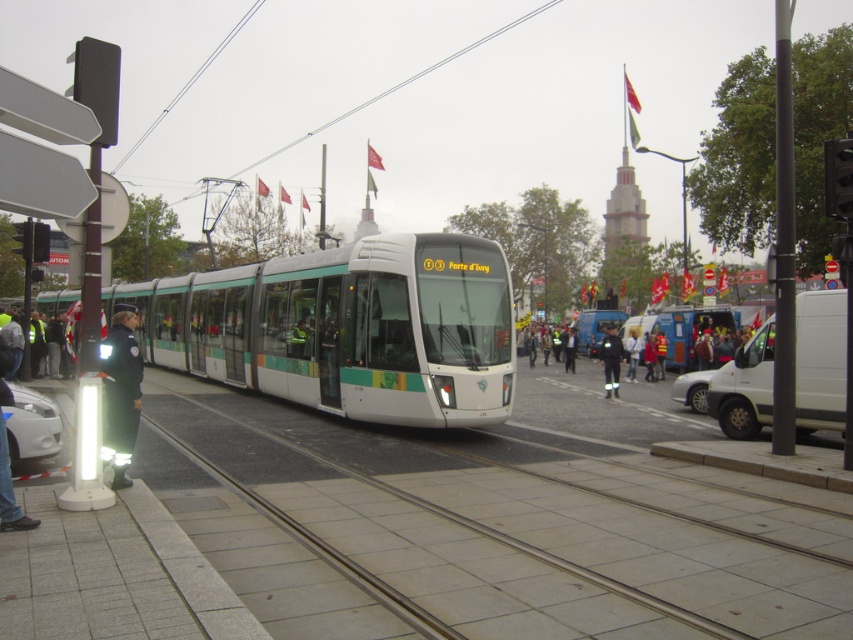
You are a pedestrian looking at the scene. You see a dark blue uniform at center and a white fabric jacket at center. Which one is positioned more to the left?

The dark blue uniform at center is positioned to the left of the white fabric jacket at center, so it is more to the left.

You are a pedestrian trying to cross the street and see both the dark blue uniform at center and the white fabric jacket at center. Which clothing item is wider from your perspective?

The dark blue uniform at center might be wider than white fabric jacket at center, so the dark blue uniform at center appears wider.

You are a delivery person standing on the sidewalk near the tram tracks. You need to place a large package on top of the white glossy tram at center and the white fabric jacket at center. Which object can you place the package on without needing a ladder?

The white glossy tram at center is taller than the white fabric jacket at center, so you can place the package on the white glossy tram at center without needing a ladder.